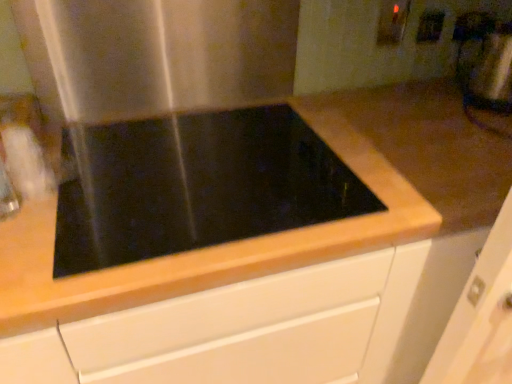
Question: Considering the relative sizes of matte white electric outlet at upper right, which is the 2th electric outlet from right to left, and metallic silver blender at upper right in the image provided, is matte white electric outlet at upper right, which is the 2th electric outlet from right to left, bigger than metallic silver blender at upper right?

Choices:
 (A) no
 (B) yes

Answer: (A)

Question: Is the position of matte white electric outlet at upper right, which is the 1th electric outlet from left to right, less distant than that of metallic silver blender at upper right?

Choices:
 (A) yes
 (B) no

Answer: (B)

Question: Does matte white electric outlet at upper right, which is the 2th electric outlet from right to left, appear on the left side of metallic silver blender at upper right?

Choices:
 (A) yes
 (B) no

Answer: (A)

Question: Is matte white electric outlet at upper right, which is the 2th electric outlet from right to left, wider than metallic silver blender at upper right?

Choices:
 (A) no
 (B) yes

Answer: (A)

Question: Is matte white electric outlet at upper right, which is the 1th electric outlet from left to right, oriented away from metallic silver blender at upper right?

Choices:
 (A) no
 (B) yes

Answer: (A)

Question: From the image's perspective, is matte white electric outlet at upper right, which is the 1th electric outlet from left to right, under metallic silver blender at upper right?

Choices:
 (A) no
 (B) yes

Answer: (A)

Question: Is white plastic electric outlet at upper right, the second electric outlet from the left, taller than black glass cooktop at center?

Choices:
 (A) yes
 (B) no

Answer: (B)

Question: Is white plastic electric outlet at upper right, the second electric outlet from the left, oriented towards black glass cooktop at center?

Choices:
 (A) no
 (B) yes

Answer: (A)

Question: Can you confirm if white plastic electric outlet at upper right, the second electric outlet from the left, is wider than black glass cooktop at center?

Choices:
 (A) yes
 (B) no

Answer: (B)

Question: Is white plastic electric outlet at upper right, the second electric outlet from the left, bigger than black glass cooktop at center?

Choices:
 (A) yes
 (B) no

Answer: (B)

Question: Does white plastic electric outlet at upper right, the second electric outlet from the left, have a lesser width compared to black glass cooktop at center?

Choices:
 (A) yes
 (B) no

Answer: (A)

Question: Are white plastic electric outlet at upper right, the second electric outlet from the left, and black glass cooktop at center far apart?

Choices:
 (A) yes
 (B) no

Answer: (B)

Question: Does metallic silver blender at upper right have a larger size compared to black glass cooktop at center?

Choices:
 (A) yes
 (B) no

Answer: (B)